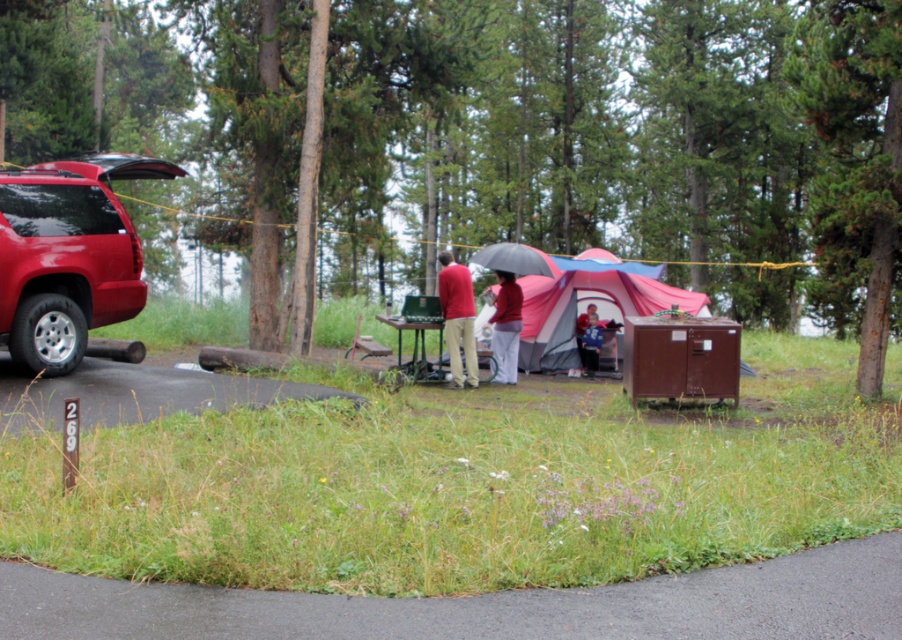
Question: Is pink fabric tent at center thinner than matte red umbrella at center?

Choices:
 (A) yes
 (B) no

Answer: (B)

Question: Which object appears farthest from the camera in this image?

Choices:
 (A) matte red shirt at center
 (B) shiny red suv at left
 (C) pink fabric tent at center

Answer: (C)

Question: Which object is closer to the camera taking this photo?

Choices:
 (A) matte red umbrella at center
 (B) black matte umbrella at center
 (C) matte red shirt at center
 (D) pink fabric tent at center

Answer: (C)

Question: Can you confirm if matte red shirt at center is thinner than black matte umbrella at center?

Choices:
 (A) yes
 (B) no

Answer: (A)

Question: Which point is farther from the camera taking this photo?

Choices:
 (A) (536, 272)
 (B) (475, 321)
 (C) (63, 308)
 (D) (473, 372)

Answer: (B)

Question: Is matte red shirt at center wider than matte red umbrella at center?

Choices:
 (A) no
 (B) yes

Answer: (A)